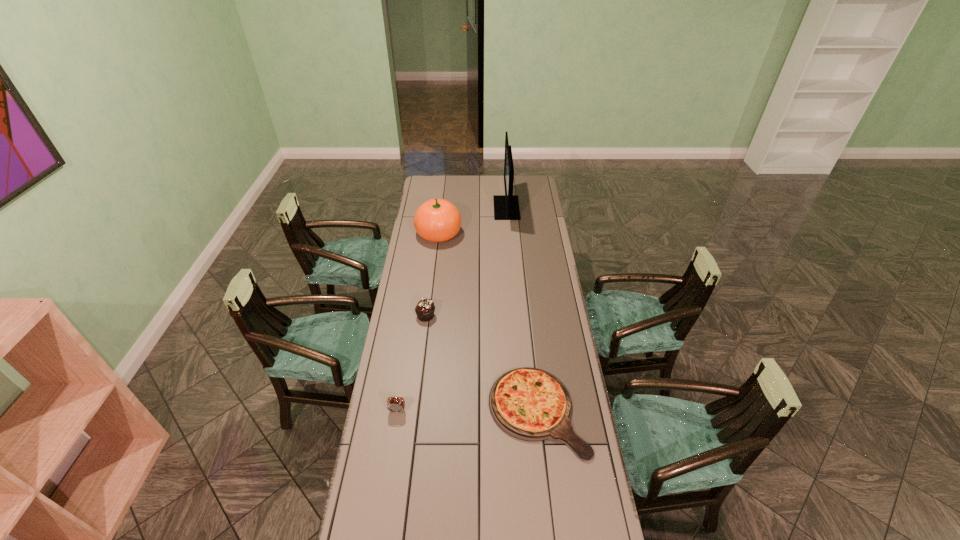
Identify the location of the tallest object. (506, 207).

Identify the location of pumpkin. The image size is (960, 540). (437, 220).

In order to click on the third farthest object in this screenshot , I will do `click(425, 308)`.

The width and height of the screenshot is (960, 540). What are the coordinates of `alarm clock` in the screenshot? It's located at (397, 404).

Find the location of `the shortest object`. the shortest object is located at coordinates (530, 404).

This screenshot has width=960, height=540. Identify the location of vacant space located 0.350m on the screen side of the monitor. (435, 208).

What are the coordinates of `blank area located 0.200m on the screen side of the monitor` in the screenshot? It's located at (460, 208).

Image resolution: width=960 pixels, height=540 pixels. In order to click on free spot located on the screen side of the monitor in this screenshot , I will do `click(484, 208)`.

Where is `free space located on the back of the second tallest object`? The height and width of the screenshot is (540, 960). free space located on the back of the second tallest object is located at coordinates (443, 199).

What are the coordinates of `vacant space located 0.170m on the front of the third nearest object` in the screenshot? It's located at (421, 354).